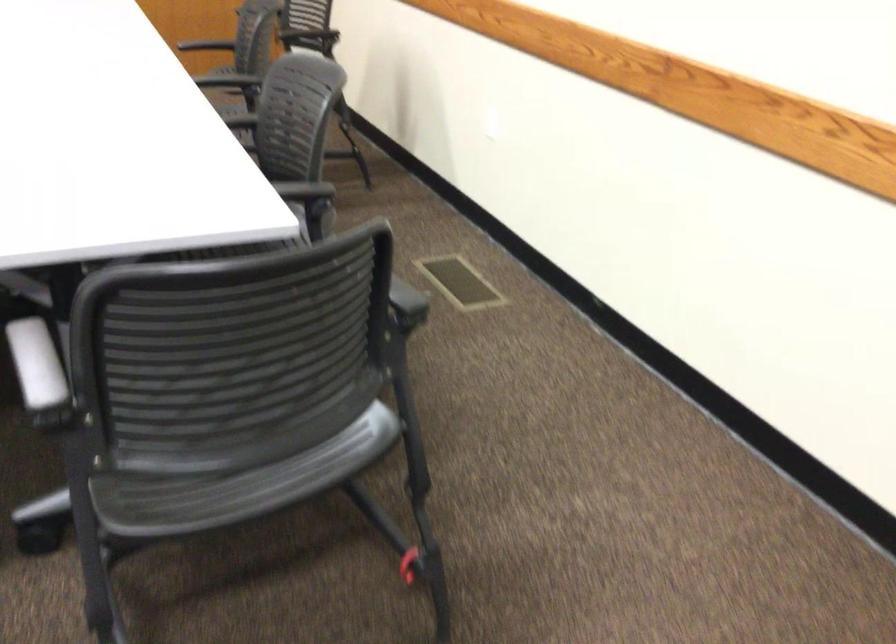
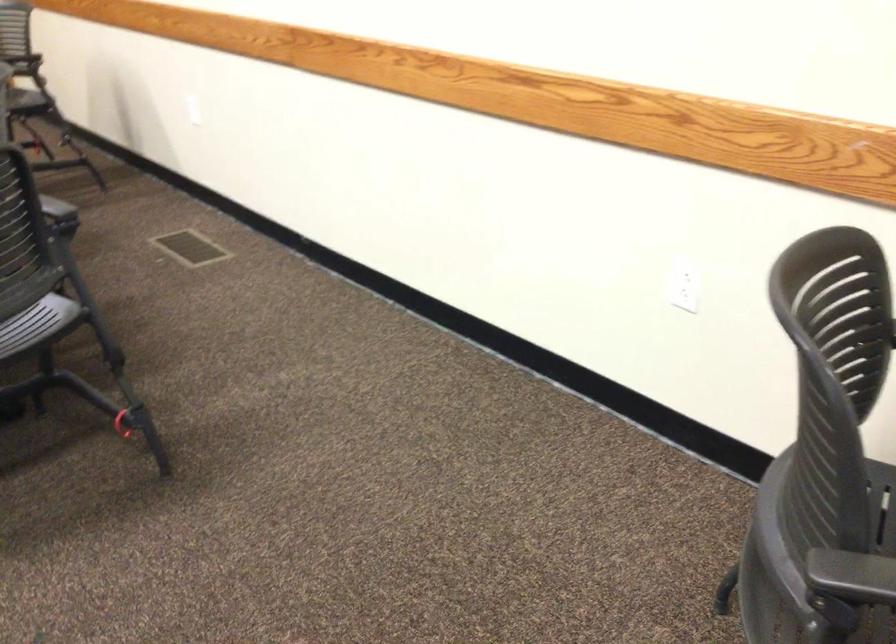
Where in the second image is the point corresponding to pixel 375 297 from the first image?

(56, 207)